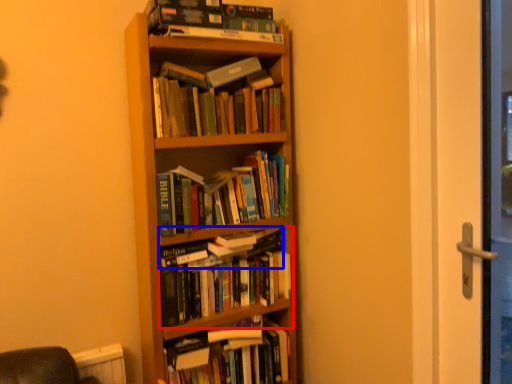
Question: Among these objects, which one is farthest to the camera, book (highlighted by a red box) or book (highlighted by a blue box)?

Choices:
 (A) book
 (B) book

Answer: (B)